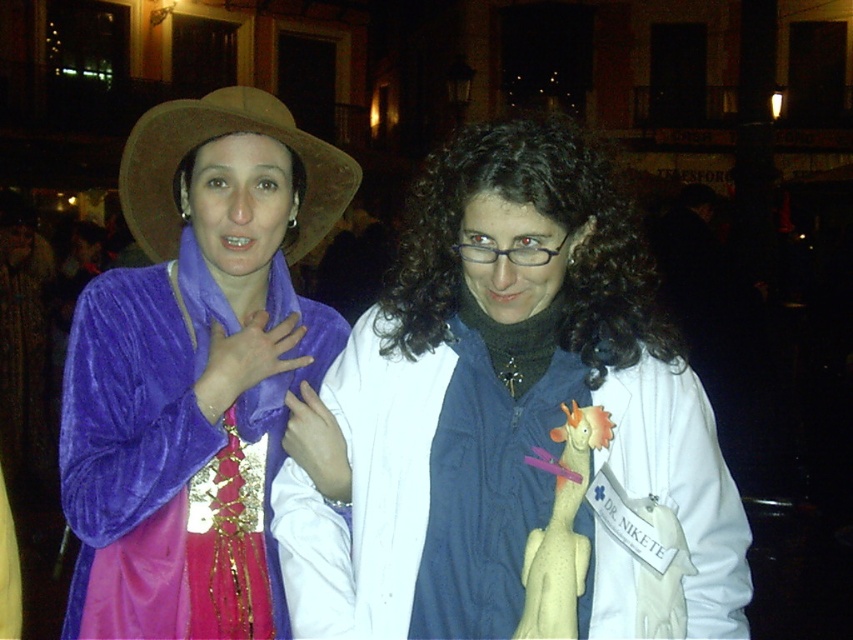
Question: Does white matte coat at center have a larger size compared to brown felt cowboy hat at upper left?

Choices:
 (A) no
 (B) yes

Answer: (A)

Question: Which of these objects is positioned closest to the velvet purple dress at left?

Choices:
 (A) brown felt cowboy hat at upper left
 (B) white matte coat at center

Answer: (A)

Question: Is the position of velvet purple dress at left less distant than that of brown felt cowboy hat at upper left?

Choices:
 (A) yes
 (B) no

Answer: (A)

Question: Which point appears closest to the camera in this image?

Choices:
 (A) (169, 522)
 (B) (143, 186)
 (C) (541, 564)

Answer: (C)

Question: Which object is positioned closest to the white matte coat at center?

Choices:
 (A) velvet purple dress at left
 (B) brown felt cowboy hat at upper left

Answer: (A)

Question: Is white matte coat at center wider than velvet purple dress at left?

Choices:
 (A) yes
 (B) no

Answer: (A)